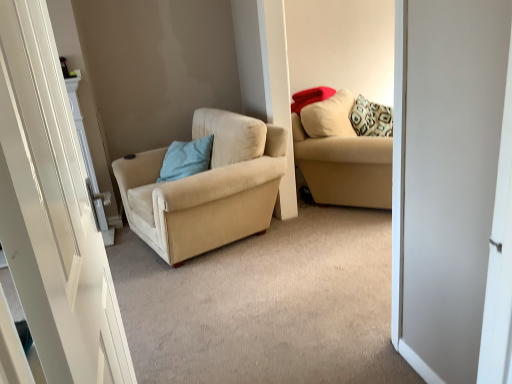
Question: Do you think white glossy door at left is within matte red pillow at upper right, arranged as the 1th pillow when viewed from the right, or outside of it?

Choices:
 (A) outside
 (B) inside

Answer: (A)

Question: From a real-world perspective, is white glossy door at left physically located above or below matte red pillow at upper right, which ranks as the second pillow in left-to-right order?

Choices:
 (A) above
 (B) below

Answer: (B)

Question: Estimate the real-world distances between objects in this image. Which object is closer to the beige fabric couch at upper right?

Choices:
 (A) light blue fabric pillow at center, acting as the second pillow starting from the right
 (B) beige fabric chair at center
 (C) white glossy door at left
 (D) matte red pillow at upper right, marked as the first pillow in a top-to-bottom arrangement

Answer: (D)

Question: Considering the real-world distances, which object is closest to the beige fabric chair at center?

Choices:
 (A) beige fabric couch at upper right
 (B) white glossy door at left
 (C) light blue fabric pillow at center, the 2th pillow when ordered from top to bottom
 (D) matte red pillow at upper right, placed as the 2th pillow when sorted from bottom to top

Answer: (C)